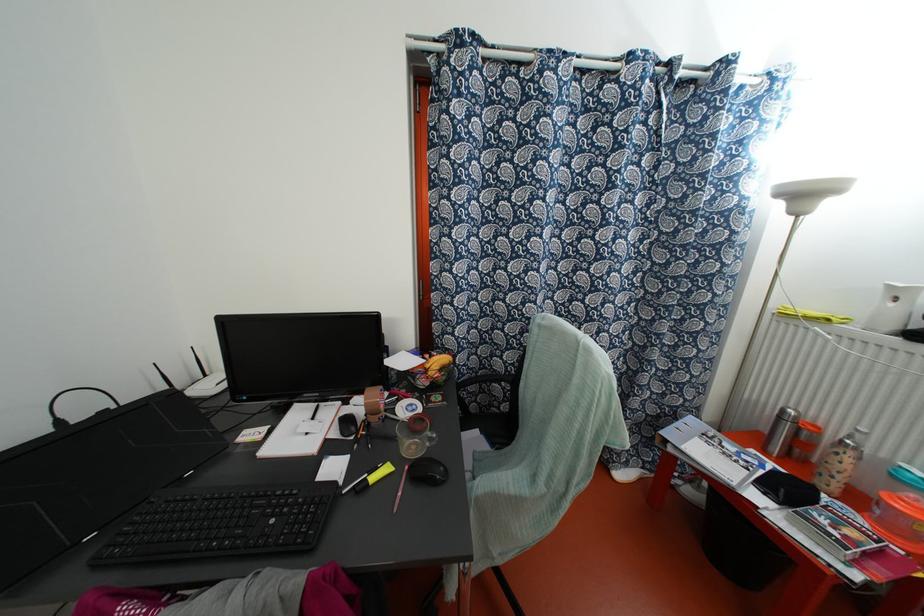
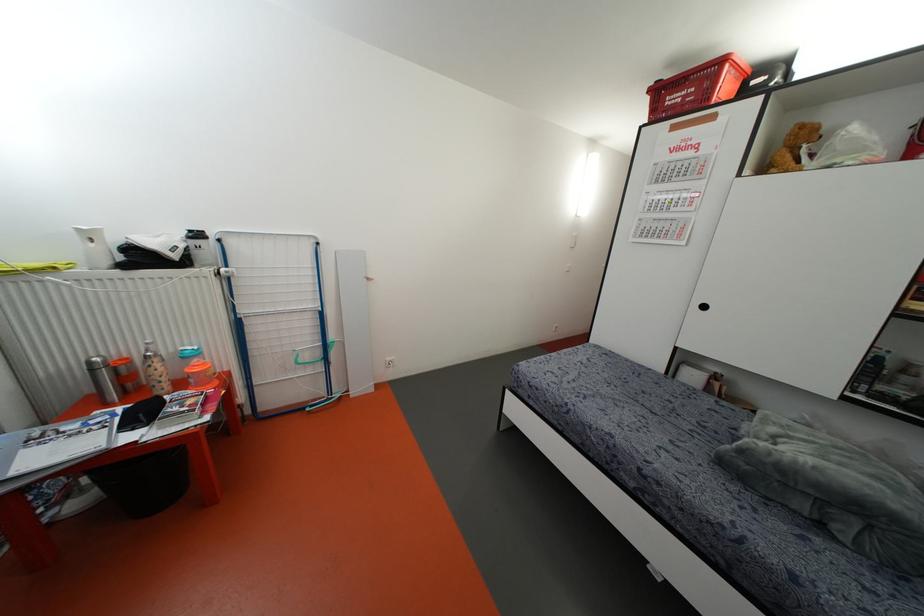
Where in the second image is the point corresponding to point (779, 416) from the first image?

(91, 370)